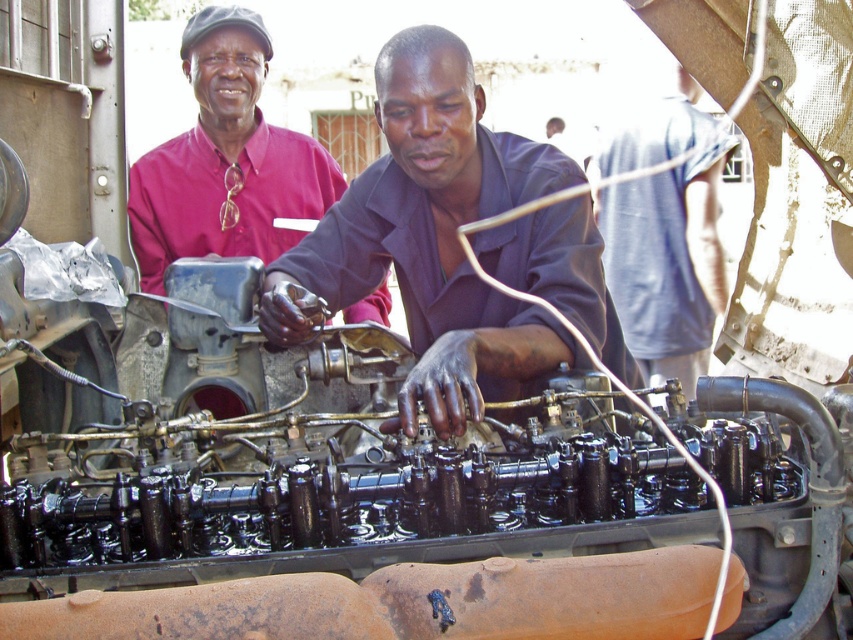
Between matte black shirt at center and gray fabric shirt at center, which one has less height?

Standing shorter between the two is matte black shirt at center.

Who is positioned more to the right, matte black shirt at center or gray fabric shirt at center?

Positioned to the right is gray fabric shirt at center.

Image resolution: width=853 pixels, height=640 pixels. Describe the element at coordinates (430, 240) in the screenshot. I see `matte black shirt at center` at that location.

Where is `matte black shirt at center`? Image resolution: width=853 pixels, height=640 pixels. matte black shirt at center is located at coordinates (430, 240).

Is matte pink shirt at upper left closer to the viewer compared to gray fabric shirt at center?

Yes.

Between matte pink shirt at upper left and gray fabric shirt at center, which one appears on the right side from the viewer's perspective?

Positioned to the right is gray fabric shirt at center.

Between point (126, 202) and point (614, 244), which one is positioned in front?

Positioned in front is point (126, 202).

Where is `matte pink shirt at upper left`? matte pink shirt at upper left is located at coordinates (225, 160).

Consider the image. Can you confirm if matte black shirt at center is thinner than matte pink shirt at upper left?

No, matte black shirt at center is not thinner than matte pink shirt at upper left.

Does matte black shirt at center have a lesser height compared to matte pink shirt at upper left?

Yes.

Is point (473, 332) positioned after point (228, 134)?

No, (473, 332) is closer to viewer.

Where is `matte black shirt at center`? The height and width of the screenshot is (640, 853). matte black shirt at center is located at coordinates (430, 240).